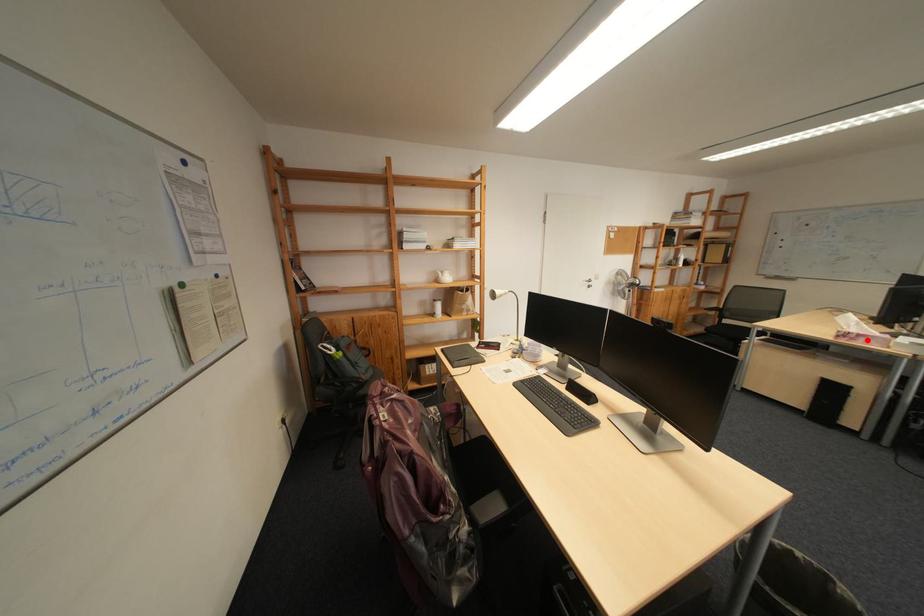
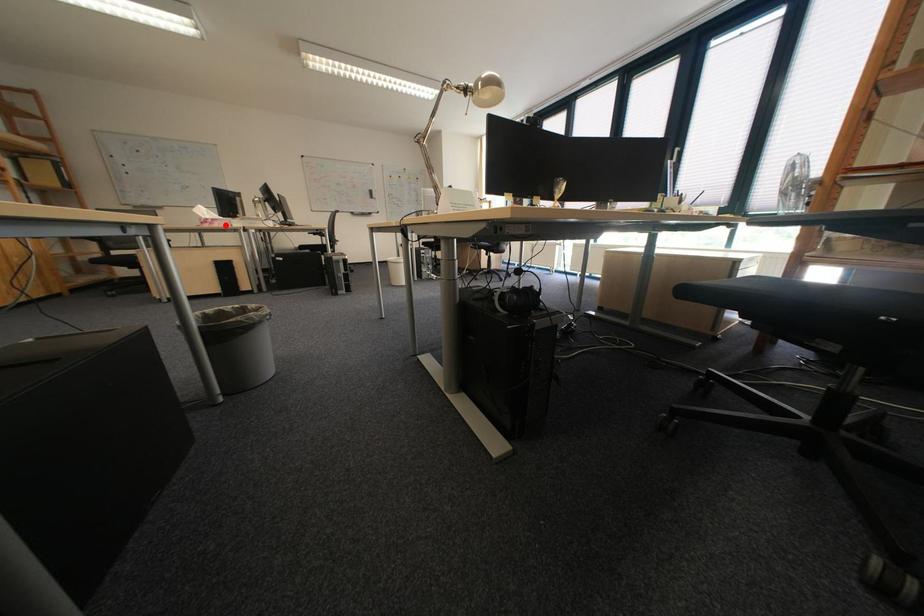
I am providing you with two images of the same scene from different viewpoints. A red point is marked on the first image and another point is marked on the second image. Are the points marked in image1 and image2 representing the same 3D position?

Yes